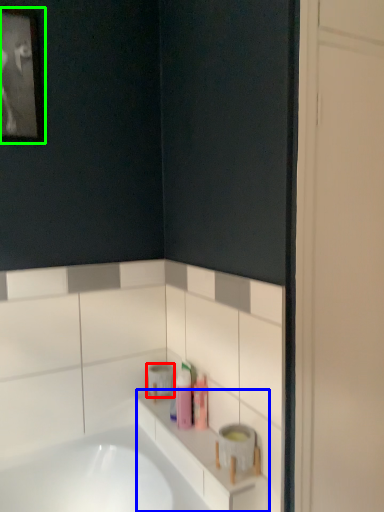
Question: Estimate the real-world distances between objects in this image. Which object is closer to toilet paper (highlighted by a red box), counter top (highlighted by a blue box) or picture frame (highlighted by a green box)?

Choices:
 (A) counter top
 (B) picture frame

Answer: (A)